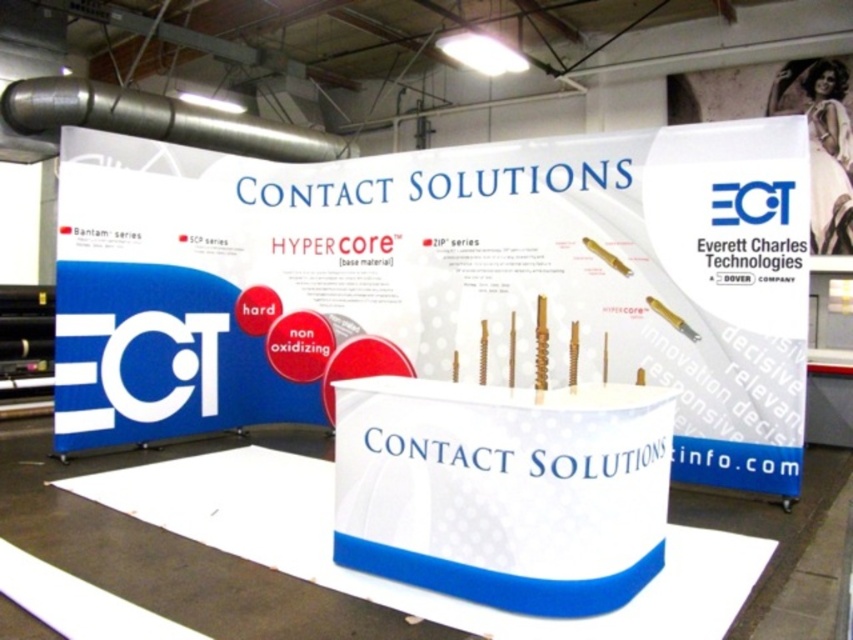
Is white matte poster at center positioned at the back of white glossy poster at upper right?

No, white matte poster at center is in front of white glossy poster at upper right.

Is point (798, 320) positioned before point (788, 68)?

Yes, point (798, 320) is closer to viewer.

Does point (305, 196) come closer to viewer compared to point (851, 125)?

Yes, point (305, 196) is in front of point (851, 125).

Where is `white matte poster at center`? Image resolution: width=853 pixels, height=640 pixels. white matte poster at center is located at coordinates (440, 282).